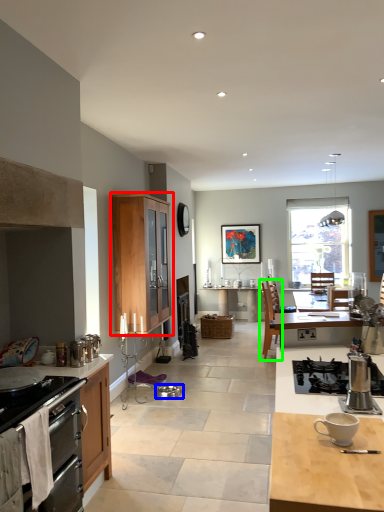
Question: Based on their relative distances, which object is farther from cabinetry (highlighted by a red box)? Choose from kitchen appliance (highlighted by a blue box) and chair (highlighted by a green box).

Choices:
 (A) kitchen appliance
 (B) chair

Answer: (B)